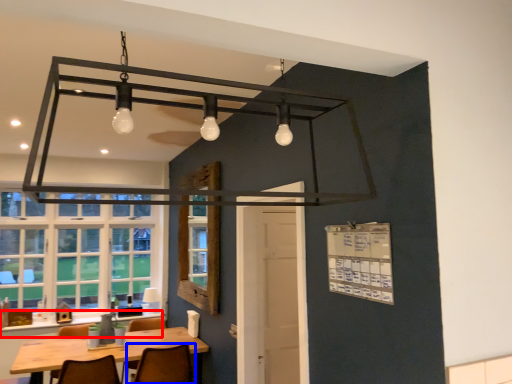
Question: Which of the following is the farthest to the observer, counter top (highlighted by a red box) or chair (highlighted by a blue box)?

Choices:
 (A) counter top
 (B) chair

Answer: (A)